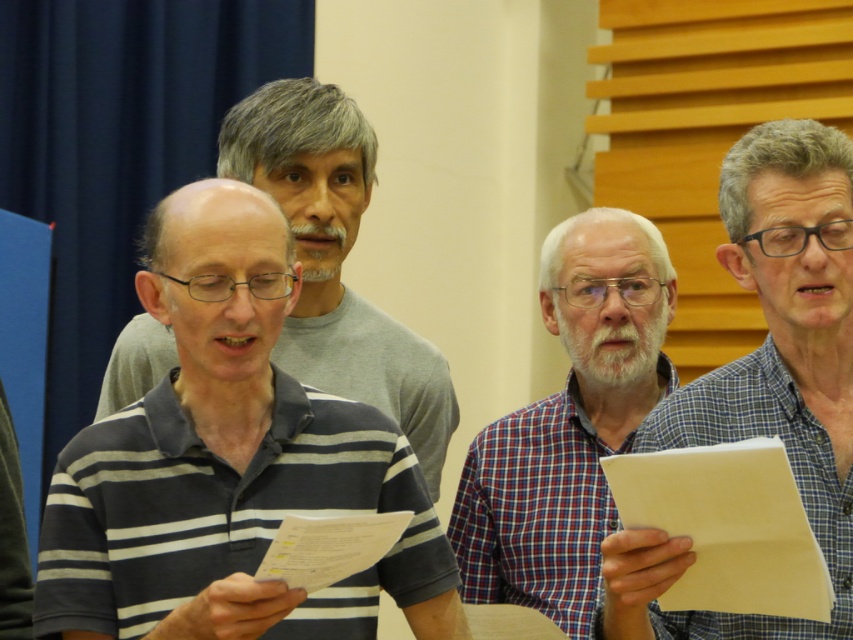
Question: Which point appears farthest from the camera in this image?

Choices:
 (A) (700, 483)
 (B) (375, 355)
 (C) (352, 556)
 (D) (839, 605)

Answer: (B)

Question: Which point is closer to the camera?

Choices:
 (A) blue plaid shirt at center
 (B) striped cotton shirt at center

Answer: (A)

Question: Is blue plaid shirt at center in front of striped cotton shirt at center?

Choices:
 (A) yes
 (B) no

Answer: (A)

Question: Is plaid fabric shirt at center behind yellow paper at lower right?

Choices:
 (A) no
 (B) yes

Answer: (B)

Question: Among these points, which one is farthest from the camera?

Choices:
 (A) (817, 442)
 (B) (395, 516)

Answer: (A)

Question: Is blue plaid shirt at center wider than striped cotton shirt at center?

Choices:
 (A) yes
 (B) no

Answer: (B)